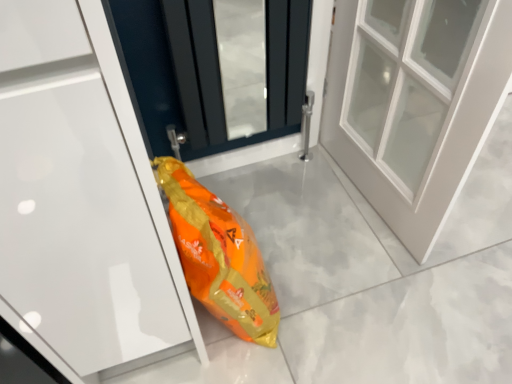
The image size is (512, 384). Find the location of `orange plastic bag at center`. orange plastic bag at center is located at coordinates (219, 256).

What do you see at coordinates (219, 256) in the screenshot? I see `orange plastic bag at center` at bounding box center [219, 256].

Find the location of a particular element. orange plastic bag at center is located at coordinates (219, 256).